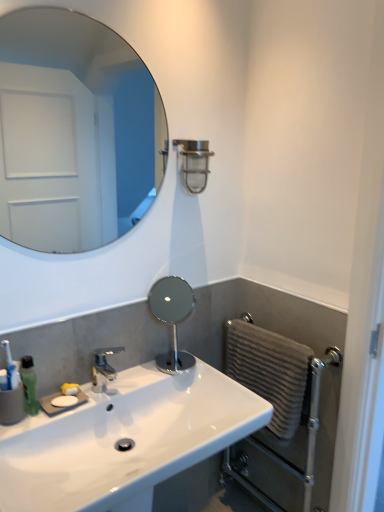
This screenshot has height=512, width=384. What are the coordinates of `free area behind silver metallic faucet at center` in the screenshot? It's located at (137, 375).